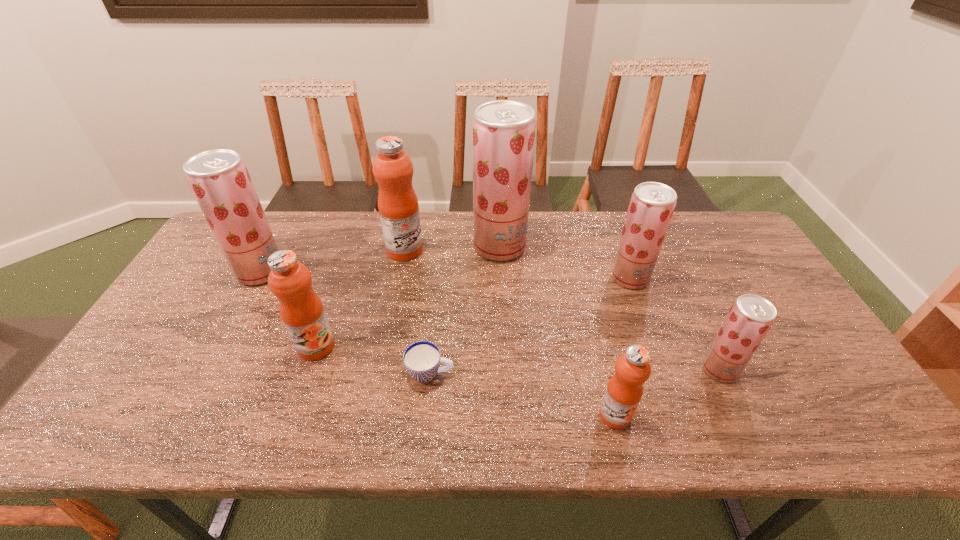
You are a GUI agent. You are given a task and a screenshot of the screen. Output one action in this format:
    pyautogui.click(x=<x>, y=<y>)
    Task: Click on the free spot between the farthest orange fruit juice and the leftmost object
    This screenshot has height=540, width=960.
    Given the screenshot: What is the action you would take?
    pyautogui.click(x=333, y=261)

The image size is (960, 540). Identify the location of object that is the third nearest to the leftmost fruit juice. (422, 359).

Identify which object is the sixth closest to the sixth object from right to left. Please provide its 2D coordinates. Your answer should be formatted as a tuple, i.e. [(x, y)], where the tuple contains the x and y coordinates of a point satisfying the conditions above.

[(624, 390)]

Find the location of a particular element. fruit juice that can be found as the fifth closest to the tallest fruit juice is located at coordinates (750, 318).

Choose which fruit juice is the sixth nearest neighbor to the second fruit juice from right to left. Please provide its 2D coordinates. Your answer should be formatted as a tuple, i.e. [(x, y)], where the tuple contains the x and y coordinates of a point satisfying the conditions above.

[(219, 179)]

At what (x,y) coordinates should I click in order to perform the action: click on the third closest strawberry fruit juice to the farthest orange fruit juice. Please return your answer as a coordinate pair (x, y). This screenshot has height=540, width=960. Looking at the image, I should click on (652, 204).

Identify which strawberry fruit juice is the third closest to the rightmost object. Please provide its 2D coordinates. Your answer should be formatted as a tuple, i.e. [(x, y)], where the tuple contains the x and y coordinates of a point satisfying the conditions above.

[(219, 179)]

Identify which orange fruit juice is the nearest to the third biggest strawberry fruit juice. Please provide its 2D coordinates. Your answer should be formatted as a tuple, i.e. [(x, y)], where the tuple contains the x and y coordinates of a point satisfying the conditions above.

[(624, 390)]

Locate an element on the screen. The height and width of the screenshot is (540, 960). orange fruit juice that is the second closest to the second fruit juice from right to left is located at coordinates (398, 207).

I want to click on free space that satisfies the following two spatial constraints: 1. on the front label of the second orange fruit juice from right to left; 2. on the front label of the second object from left to right, so click(386, 346).